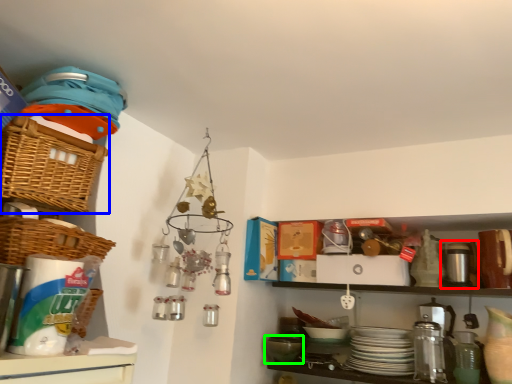
Question: Which object is positioned farthest from appliance (highlighted by a red box)? Select from basket (highlighted by a blue box) and mixing bowl (highlighted by a green box).

Choices:
 (A) basket
 (B) mixing bowl

Answer: (A)